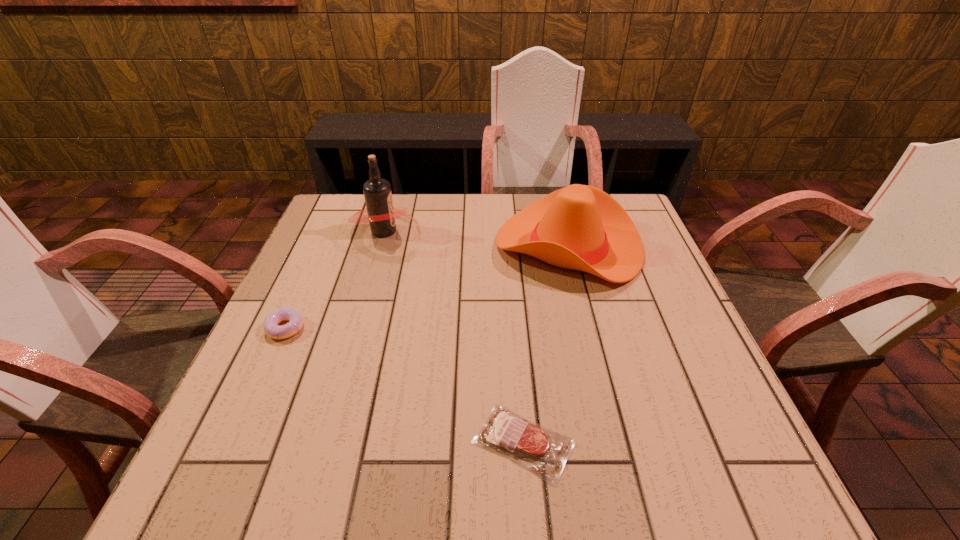
Where is `the second object from left to right`? the second object from left to right is located at coordinates click(x=381, y=216).

At what (x,y) coordinates should I click in order to perform the action: click on the tallest object. Please return your answer as a coordinate pair (x, y). This screenshot has width=960, height=540. Looking at the image, I should click on (381, 216).

I want to click on cowboy hat, so pyautogui.click(x=579, y=227).

I want to click on the third tallest object, so click(270, 325).

This screenshot has height=540, width=960. I want to click on the leftmost object, so click(270, 325).

Locate an element on the screen. The image size is (960, 540). steak is located at coordinates (532, 446).

You are a GUI agent. You are given a task and a screenshot of the screen. Output one action in this format:
    pyautogui.click(x=<x>, y=<y>)
    Task: Click on the nearest object
    This screenshot has height=540, width=960.
    Given the screenshot: What is the action you would take?
    pyautogui.click(x=532, y=446)

Find the location of a particular element. free spot located on the label of the third object from right to left is located at coordinates (449, 231).

At what (x,y) coordinates should I click in order to perform the action: click on vacant space located 0.140m on the left of the cowboy hat. Please return your answer as a coordinate pair (x, y). Image resolution: width=960 pixels, height=540 pixels. Looking at the image, I should click on (444, 246).

Locate an element on the screen. This screenshot has width=960, height=540. vacant area located on the front of the second nearest object is located at coordinates (245, 419).